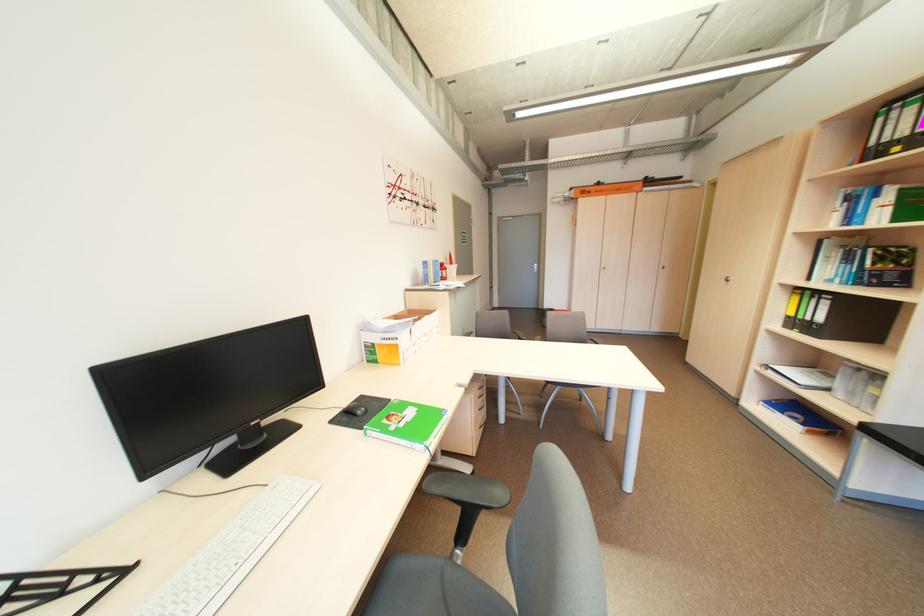
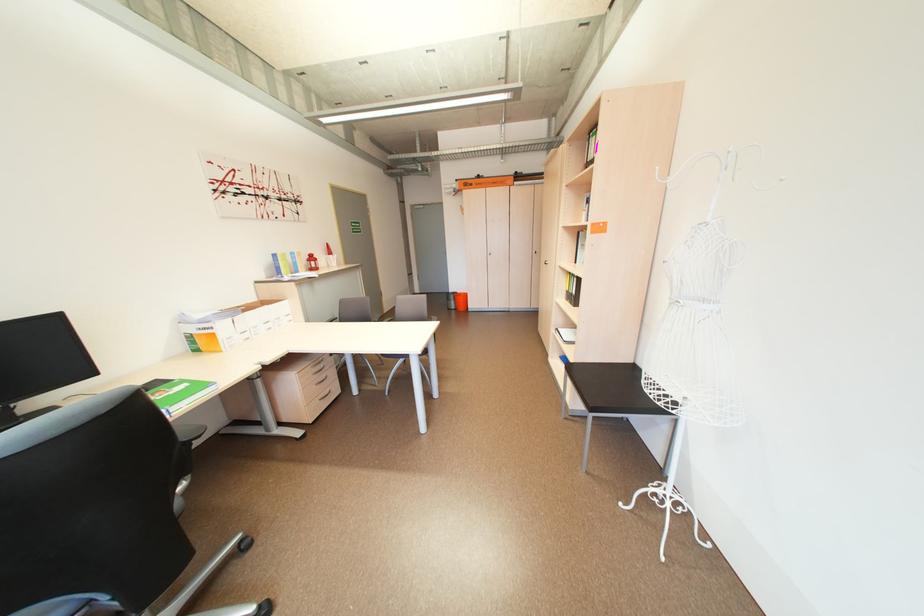
Locate, in the second image, the point that corresponds to (371,398) in the first image.

(164, 382)